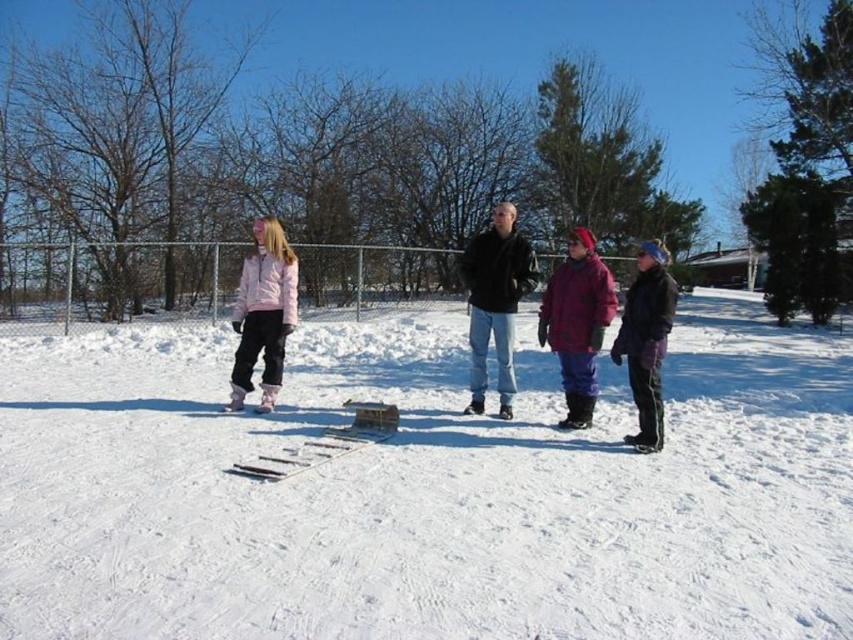
Can you confirm if black matte jacket at center is thinner than pink fleece jacket at left?

Yes.

Is black matte jacket at center smaller than pink fleece jacket at left?

Yes, black matte jacket at center is smaller than pink fleece jacket at left.

Identify the location of black matte jacket at center. This screenshot has width=853, height=640. (495, 301).

Between point (560, 273) and point (633, 307), which one is positioned behind?

Point (560, 273)

Can you confirm if purple fleece jacket at center is wider than purple fleece jacket at right?

Correct, the width of purple fleece jacket at center exceeds that of purple fleece jacket at right.

The height and width of the screenshot is (640, 853). Identify the location of purple fleece jacket at center. (577, 323).

Identify the location of purple fleece jacket at center. This screenshot has width=853, height=640. click(577, 323).

This screenshot has height=640, width=853. Identify the location of black matte jacket at center. (495, 301).

Is point (471, 349) positioned behind point (645, 408)?

Yes, it is.

In order to click on black matte jacket at center in this screenshot , I will do `click(495, 301)`.